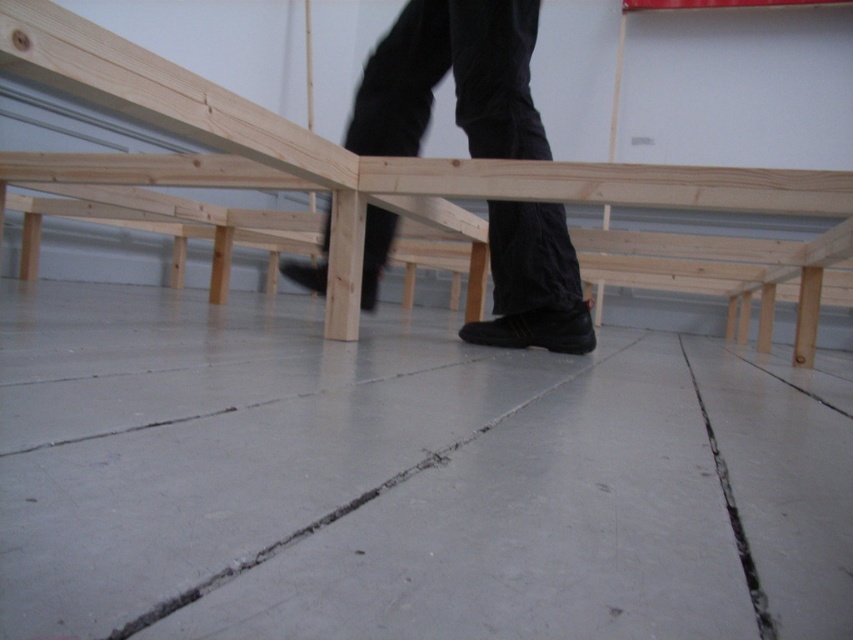
Can you confirm if natural wood bunk bed at center is shorter than black matte pants at center?

Indeed, natural wood bunk bed at center has a lesser height compared to black matte pants at center.

Between natural wood bunk bed at center and black matte pants at center, which one has more height?

With more height is black matte pants at center.

I want to click on natural wood bunk bed at center, so click(x=370, y=157).

Where is `natural wood bunk bed at center`? This screenshot has height=640, width=853. natural wood bunk bed at center is located at coordinates (370, 157).